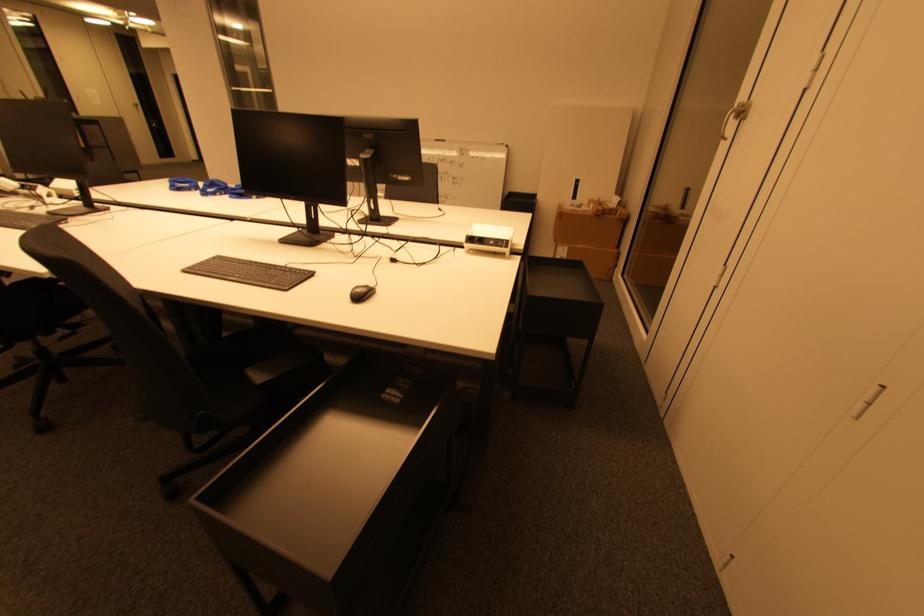
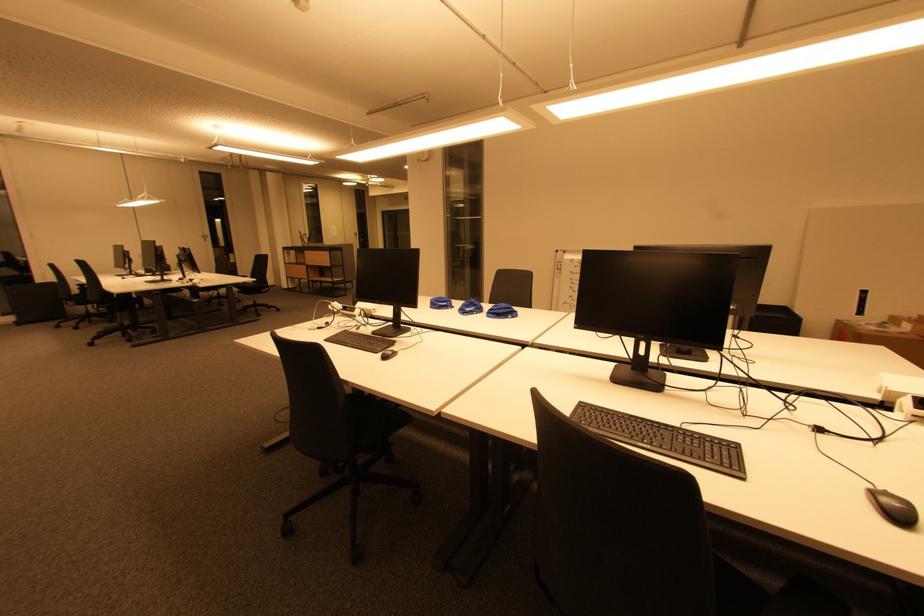
Question: Which direction would the cameraman need to move to produce the second image? Reply with the corresponding letter.

Choices:
 (A) Left
 (B) Right
 (C) Forward
 (D) Backward

Answer: (A)